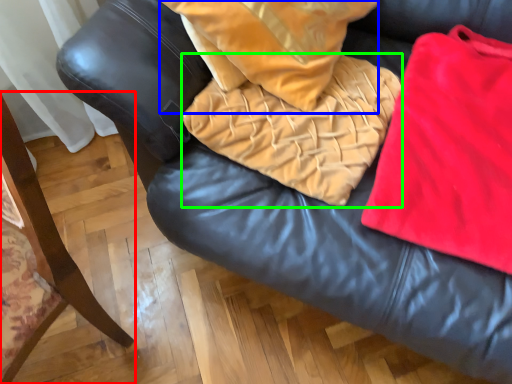
Question: Which is nearer to the furniture (highlighted by a red box)? throw pillow (highlighted by a blue box) or blanket (highlighted by a green box).

Choices:
 (A) throw pillow
 (B) blanket

Answer: (B)